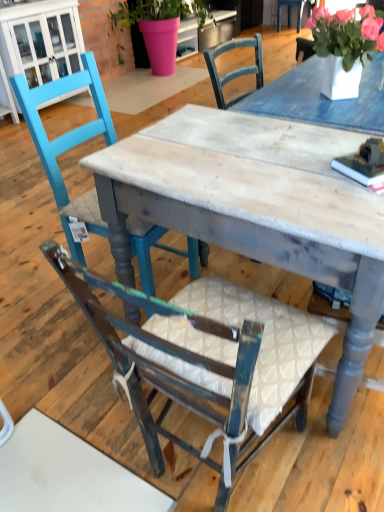
Where is `vacant space situated above distressed wood table at center (from a real-world perspective)`? The image size is (384, 512). vacant space situated above distressed wood table at center (from a real-world perspective) is located at coordinates (261, 158).